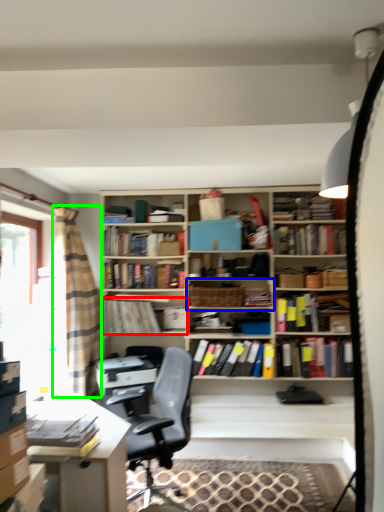
Question: Which object is positioned closest to book (highlighted by a red box)? Select from shelf (highlighted by a blue box) and curtain (highlighted by a green box).

Choices:
 (A) shelf
 (B) curtain

Answer: (B)